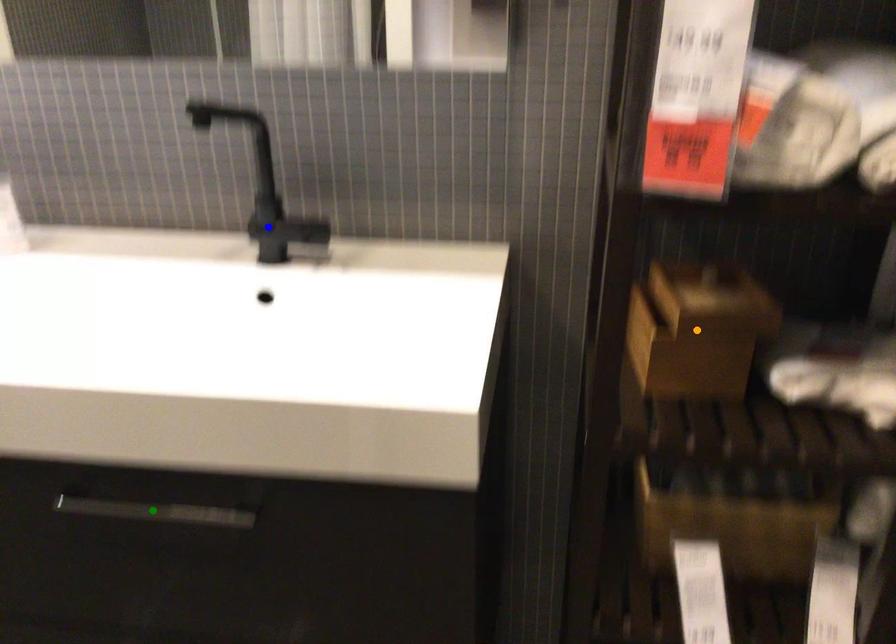
Order these from nearest to farthest:
A) blue point
B) green point
C) orange point

orange point
green point
blue point